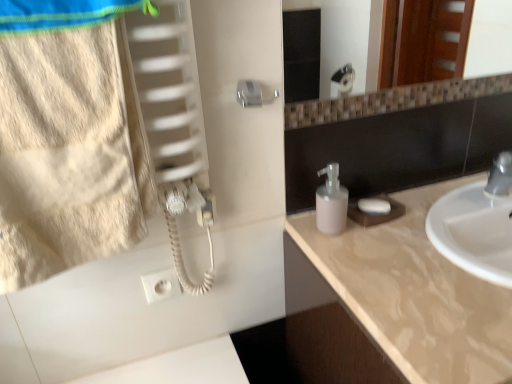
Question: From the image's perspective, is white matte soap at right below beige cotton towel at left?

Choices:
 (A) yes
 (B) no

Answer: (A)

Question: Are white matte soap at right and beige cotton towel at left beside each other?

Choices:
 (A) no
 (B) yes

Answer: (A)

Question: Considering the relative sizes of white matte soap at right and beige cotton towel at left in the image provided, is white matte soap at right smaller than beige cotton towel at left?

Choices:
 (A) yes
 (B) no

Answer: (A)

Question: From a real-world perspective, is white matte soap at right physically below beige cotton towel at left?

Choices:
 (A) yes
 (B) no

Answer: (A)

Question: Is white matte soap at right wider than beige cotton towel at left?

Choices:
 (A) no
 (B) yes

Answer: (A)

Question: Is beige marble countertop at right situated inside pink matte soap dispenser at center or outside?

Choices:
 (A) outside
 (B) inside

Answer: (A)

Question: Is point (416, 327) positioned closer to the camera than point (327, 225)?

Choices:
 (A) closer
 (B) farther

Answer: (A)

Question: From a real-world perspective, is beige marble countertop at right above or below pink matte soap dispenser at center?

Choices:
 (A) above
 (B) below

Answer: (B)

Question: Considering the positions of beige marble countertop at right and pink matte soap dispenser at center in the image, is beige marble countertop at right taller or shorter than pink matte soap dispenser at center?

Choices:
 (A) short
 (B) tall

Answer: (A)

Question: Relative to pink matte soap dispenser at center, is beige cotton towel at left in front or behind?

Choices:
 (A) behind
 (B) front

Answer: (B)

Question: From a real-world perspective, is beige cotton towel at left positioned above or below pink matte soap dispenser at center?

Choices:
 (A) below
 (B) above

Answer: (B)

Question: Is beige cotton towel at left bigger or smaller than pink matte soap dispenser at center?

Choices:
 (A) small
 (B) big

Answer: (B)

Question: Is beige cotton towel at left inside or outside of pink matte soap dispenser at center?

Choices:
 (A) inside
 (B) outside

Answer: (B)

Question: Looking at their shapes, would you say beige cotton towel at left is wider or thinner than white matte soap at right?

Choices:
 (A) wide
 (B) thin

Answer: (A)

Question: From a real-world perspective, relative to white matte soap at right, is beige cotton towel at left vertically above or below?

Choices:
 (A) below
 (B) above

Answer: (B)